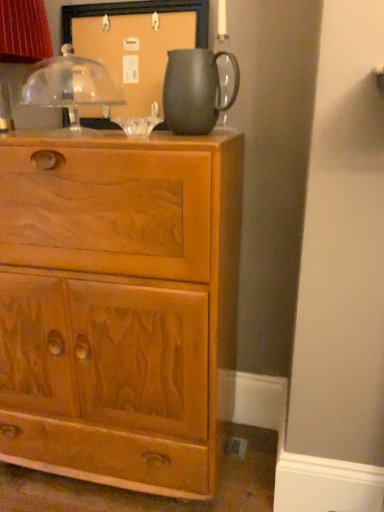
Question: Would you say matte black pitcher at upper center is a long distance from light brown wood chest of drawers at center?

Choices:
 (A) yes
 (B) no

Answer: (B)

Question: Can you confirm if matte black pitcher at upper center is shorter than light brown wood chest of drawers at center?

Choices:
 (A) no
 (B) yes

Answer: (B)

Question: Does matte black pitcher at upper center have a smaller size compared to light brown wood chest of drawers at center?

Choices:
 (A) no
 (B) yes

Answer: (B)

Question: Can you confirm if matte black pitcher at upper center is bigger than light brown wood chest of drawers at center?

Choices:
 (A) no
 (B) yes

Answer: (A)

Question: From the image's perspective, does matte black pitcher at upper center appear lower than light brown wood chest of drawers at center?

Choices:
 (A) no
 (B) yes

Answer: (A)

Question: In terms of width, does matte black pitcher at upper center look wider or thinner when compared to matte black pitcher at upper center?

Choices:
 (A) wide
 (B) thin

Answer: (B)

Question: Is point (213, 61) closer or farther from the camera than point (226, 53)?

Choices:
 (A) closer
 (B) farther

Answer: (B)

Question: Would you say matte black pitcher at upper center is to the left or to the right of matte black pitcher at upper center in the picture?

Choices:
 (A) left
 (B) right

Answer: (A)

Question: From a real-world perspective, relative to matte black pitcher at upper center, is matte black pitcher at upper center vertically above or below?

Choices:
 (A) below
 (B) above

Answer: (B)

Question: Looking at their shapes, would you say matte black pitcher at upper center is wider or thinner than matte black pitcher at upper center?

Choices:
 (A) wide
 (B) thin

Answer: (A)

Question: Would you say matte black pitcher at upper center is to the left or to the right of matte black pitcher at upper center in the picture?

Choices:
 (A) right
 (B) left

Answer: (A)

Question: Relative to matte black pitcher at upper center, is matte black pitcher at upper center in front or behind?

Choices:
 (A) front
 (B) behind

Answer: (A)

Question: From the image's perspective, is matte black pitcher at upper center located above or below matte black pitcher at upper center?

Choices:
 (A) above
 (B) below

Answer: (B)

Question: From a real-world perspective, is light brown wood chest of drawers at center physically located above or below matte black pitcher at upper center?

Choices:
 (A) above
 (B) below

Answer: (B)

Question: Is light brown wood chest of drawers at center inside or outside of matte black pitcher at upper center?

Choices:
 (A) inside
 (B) outside

Answer: (B)